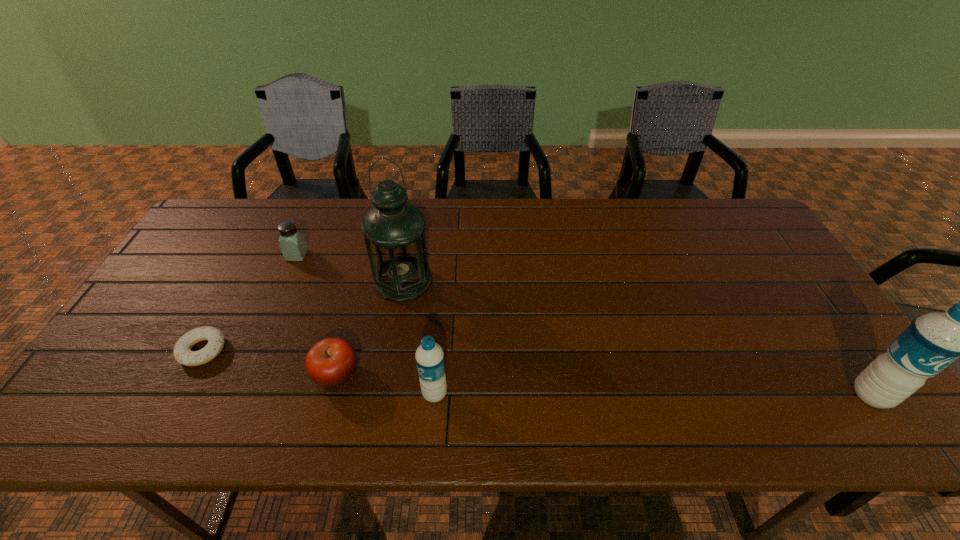
Identify the location of vacant point located between the tallest object and the fifth object from right to left. Image resolution: width=960 pixels, height=540 pixels. (350, 268).

At what (x,y) coordinates should I click in order to perform the action: click on free space between the fifth shortest object and the tallest object. Please return your answer as a coordinate pair (x, y). This screenshot has height=540, width=960. Looking at the image, I should click on (637, 338).

Locate an element on the screen. free space between the apple and the fifth object from right to left is located at coordinates (317, 315).

Where is `free spot between the apple and the left water bottle`? free spot between the apple and the left water bottle is located at coordinates [x=386, y=384].

Where is `free space that is in between the saltshaker and the tallest object`? This screenshot has height=540, width=960. free space that is in between the saltshaker and the tallest object is located at coordinates [350, 268].

Find the location of a particular element. empty space between the oil lamp and the apple is located at coordinates (370, 327).

Identify the location of vacant area that lies between the apple and the rightmost object. (604, 384).

At what (x,y) coordinates should I click in order to perform the action: click on object that can be found as the fifth closest to the third tallest object. Please return your answer as a coordinate pair (x, y). The height and width of the screenshot is (540, 960). Looking at the image, I should click on (932, 342).

Find the location of a particular element. the closest object relative to the second object from right to left is located at coordinates (331, 362).

Identify the location of free space that satisfies the following two spatial constraints: 1. on the back side of the shortest object; 2. on the left side of the fifth object from right to left. This screenshot has height=540, width=960. (253, 255).